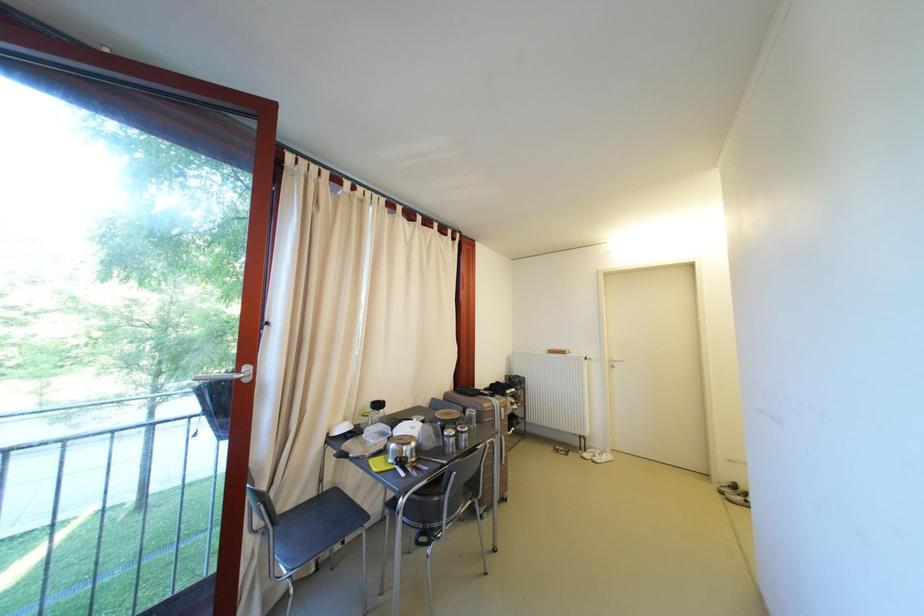
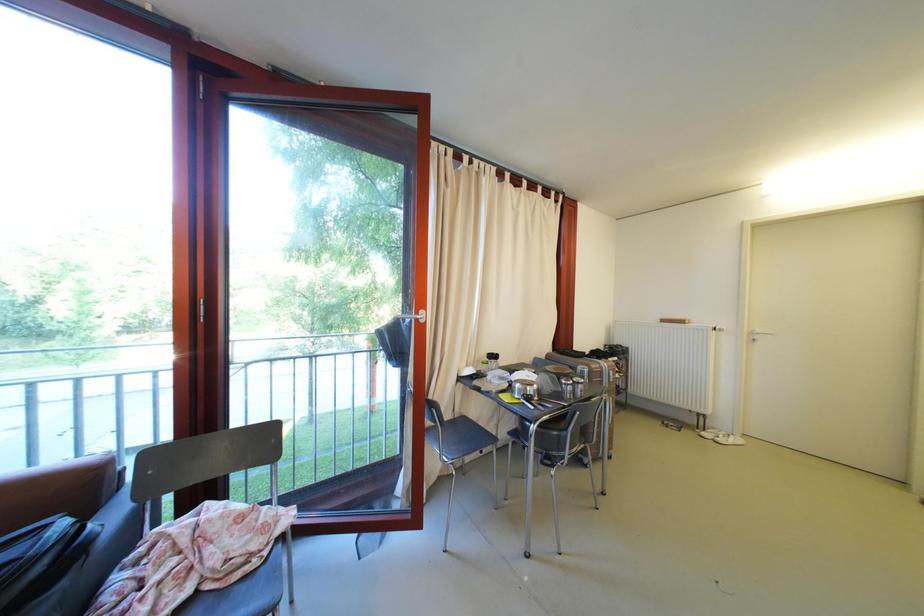
Which direction would the cameraman need to move to produce the second image?

The cameraman walked toward left, backward.